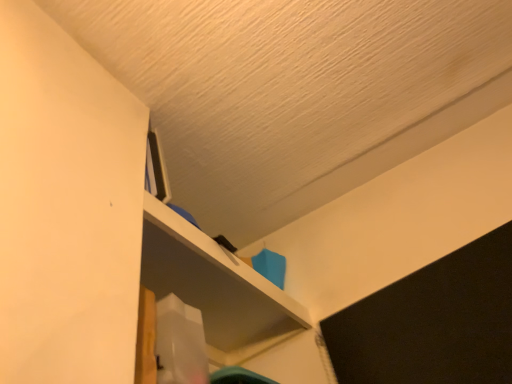
Question: Should I look upward or downward to see white matte shelf at upper center?

Choices:
 (A) down
 (B) up

Answer: (A)